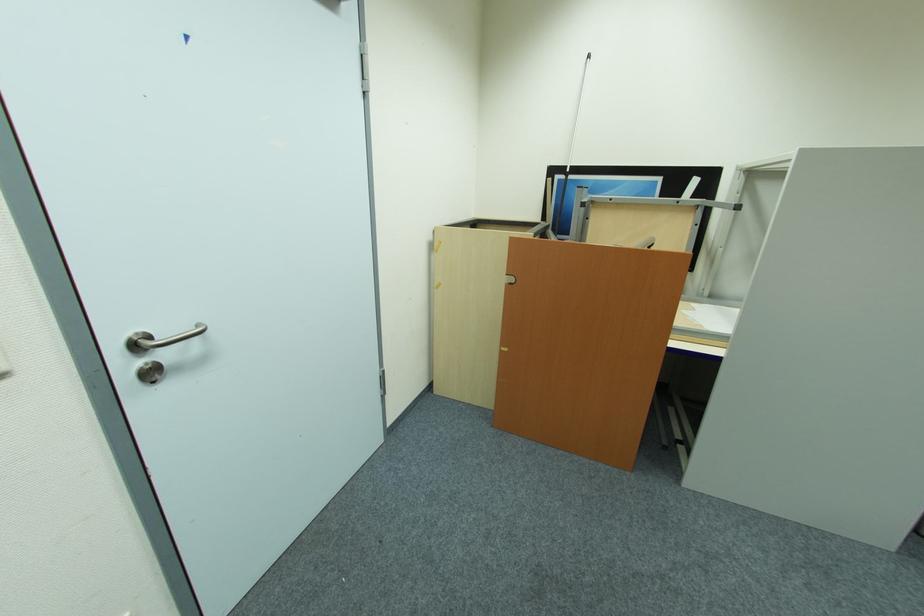
Which object does [578,111] point to?

This point indicates the white pole.